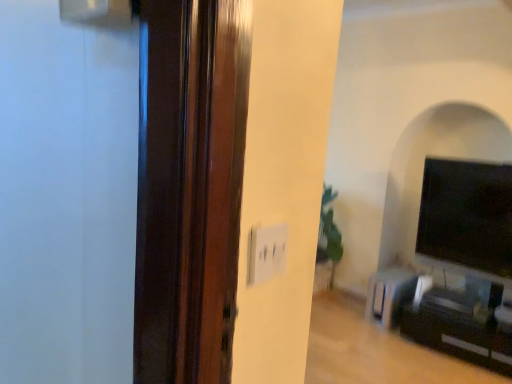
Question: In terms of width, does metallic silver speaker at lower right look wider or thinner when compared to black glossy tv at right?

Choices:
 (A) wide
 (B) thin

Answer: (A)

Question: From the image's perspective, is metallic silver speaker at lower right located above or below black glossy tv at right?

Choices:
 (A) above
 (B) below

Answer: (B)

Question: Estimate the real-world distances between objects in this image. Which object is closer to the metallic silver speaker at lower right?

Choices:
 (A) black glossy entertainment center at lower right
 (B) black glossy tv at right

Answer: (A)

Question: Based on their relative distances, which object is farther from the black glossy tv at right?

Choices:
 (A) black glossy entertainment center at lower right
 (B) metallic silver speaker at lower right

Answer: (A)